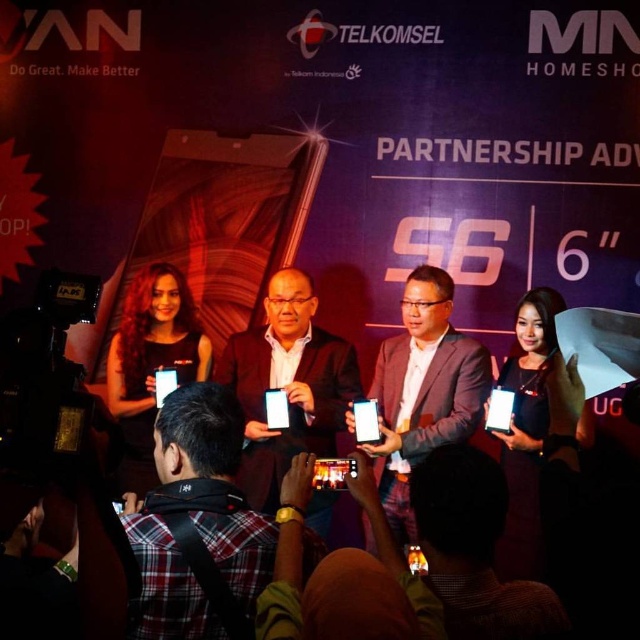
Question: Can you confirm if matte black phone at center is bigger than matte black suit at center?

Choices:
 (A) yes
 (B) no

Answer: (B)

Question: Does plaid shirt at lower left have a greater width compared to matte black suit at center?

Choices:
 (A) yes
 (B) no

Answer: (B)

Question: Which is farther from the matte black suit at center?

Choices:
 (A) matte black phone at center
 (B) plaid shirt at lower left

Answer: (B)

Question: Among these points, which one is nearest to the camera?

Choices:
 (A) (310, 548)
 (B) (301, 448)

Answer: (A)

Question: Which object is farther from the camera taking this photo?

Choices:
 (A) matte black phone at center
 (B) matte black suit at center

Answer: (A)

Question: Is plaid shirt at lower left closer to camera compared to matte black suit at center?

Choices:
 (A) no
 (B) yes

Answer: (B)